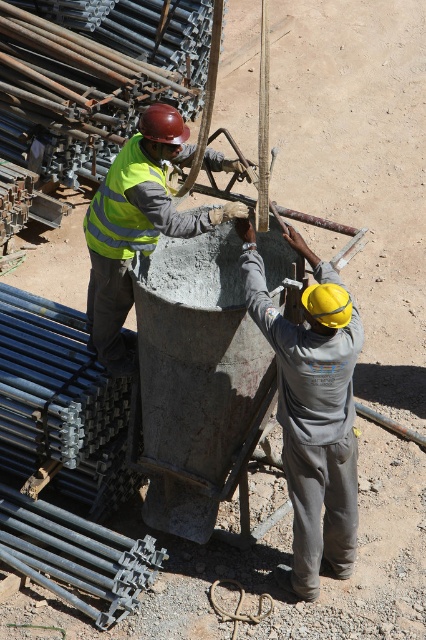
Question: Which is farther from the gray matte concrete at center?

Choices:
 (A) reflective yellow safety vest at center
 (B) reflective yellow vest at center

Answer: (A)

Question: Does gray matte concrete at center have a larger size compared to reflective yellow safety vest at center?

Choices:
 (A) yes
 (B) no

Answer: (A)

Question: Estimate the real-world distances between objects in this image. Which object is closer to the gray matte concrete at center?

Choices:
 (A) reflective yellow safety vest at center
 (B) reflective yellow vest at center

Answer: (B)

Question: Considering the relative positions of reflective yellow vest at center and reflective yellow safety vest at center in the image provided, where is reflective yellow vest at center located with respect to reflective yellow safety vest at center?

Choices:
 (A) right
 (B) left

Answer: (A)

Question: Can you confirm if gray matte concrete at center is positioned to the right of reflective yellow vest at center?

Choices:
 (A) yes
 (B) no

Answer: (A)

Question: Which object is the farthest from the gray matte concrete at center?

Choices:
 (A) reflective yellow safety vest at center
 (B) reflective yellow vest at center

Answer: (A)